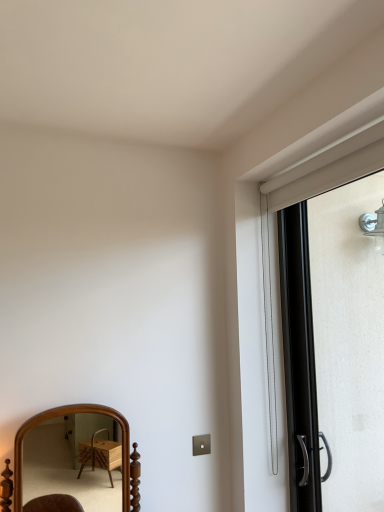
Question: Is black metallic screen door at right thinner than wooden mirror at lower left?

Choices:
 (A) no
 (B) yes

Answer: (B)

Question: From a real-world perspective, is black metallic screen door at right physically above wooden mirror at lower left?

Choices:
 (A) no
 (B) yes

Answer: (B)

Question: Does black metallic screen door at right lie in front of wooden mirror at lower left?

Choices:
 (A) no
 (B) yes

Answer: (B)

Question: Is black metallic screen door at right behind wooden mirror at lower left?

Choices:
 (A) yes
 (B) no

Answer: (B)

Question: From the image's perspective, is black metallic screen door at right beneath wooden mirror at lower left?

Choices:
 (A) yes
 (B) no

Answer: (B)

Question: Is black metallic screen door at right next to wooden mirror at lower left and touching it?

Choices:
 (A) yes
 (B) no

Answer: (B)

Question: Considering the relative sizes of wooden mirror at lower left and black metallic screen door at right in the image provided, is wooden mirror at lower left wider than black metallic screen door at right?

Choices:
 (A) yes
 (B) no

Answer: (A)

Question: Is wooden mirror at lower left oriented towards black metallic screen door at right?

Choices:
 (A) no
 (B) yes

Answer: (A)

Question: Is wooden mirror at lower left looking in the opposite direction of black metallic screen door at right?

Choices:
 (A) yes
 (B) no

Answer: (B)

Question: From the image's perspective, is wooden mirror at lower left under black metallic screen door at right?

Choices:
 (A) yes
 (B) no

Answer: (A)

Question: Is wooden mirror at lower left further to camera compared to black metallic screen door at right?

Choices:
 (A) yes
 (B) no

Answer: (A)

Question: Does wooden mirror at lower left appear on the right side of black metallic screen door at right?

Choices:
 (A) yes
 (B) no

Answer: (B)

Question: Considering the relative positions of wooden mirror at lower left and black metallic screen door at right in the image provided, is wooden mirror at lower left to the left or to the right of black metallic screen door at right?

Choices:
 (A) right
 (B) left

Answer: (B)